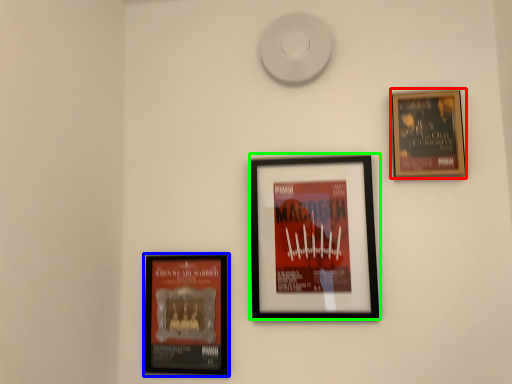
Question: Estimate the real-world distances between objects in this image. Which object is farther from picture frame (highlighted by a red box), picture frame (highlighted by a blue box) or picture frame (highlighted by a green box)?

Choices:
 (A) picture frame
 (B) picture frame

Answer: (A)